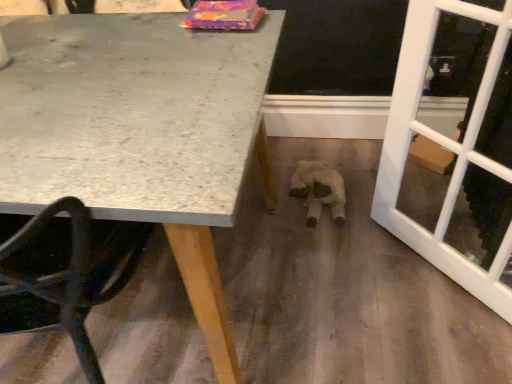
At what (x,y) coordinates should I click in order to perform the action: click on vacant area that lies between white glass screen door at right and white plush toy at center. Please return your answer as a coordinate pair (x, y). The image size is (512, 384). Looking at the image, I should click on (373, 231).